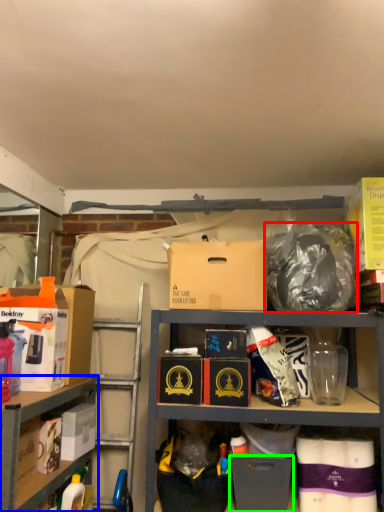
Question: Based on their relative distances, which object is farther from garbage (highlighted by a red box)? Choose from shelf (highlighted by a blue box) and box (highlighted by a green box).

Choices:
 (A) shelf
 (B) box

Answer: (A)